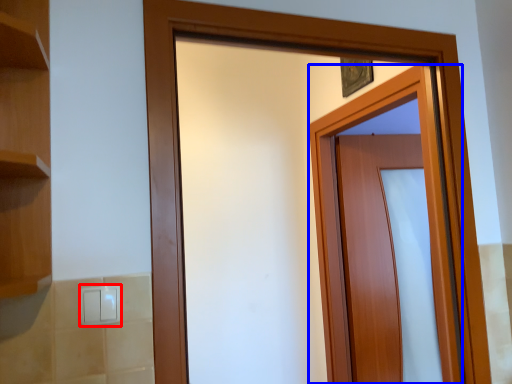
Question: Among these objects, which one is farthest to the camera, light switch (highlighted by a red box) or door (highlighted by a blue box)?

Choices:
 (A) light switch
 (B) door

Answer: (B)